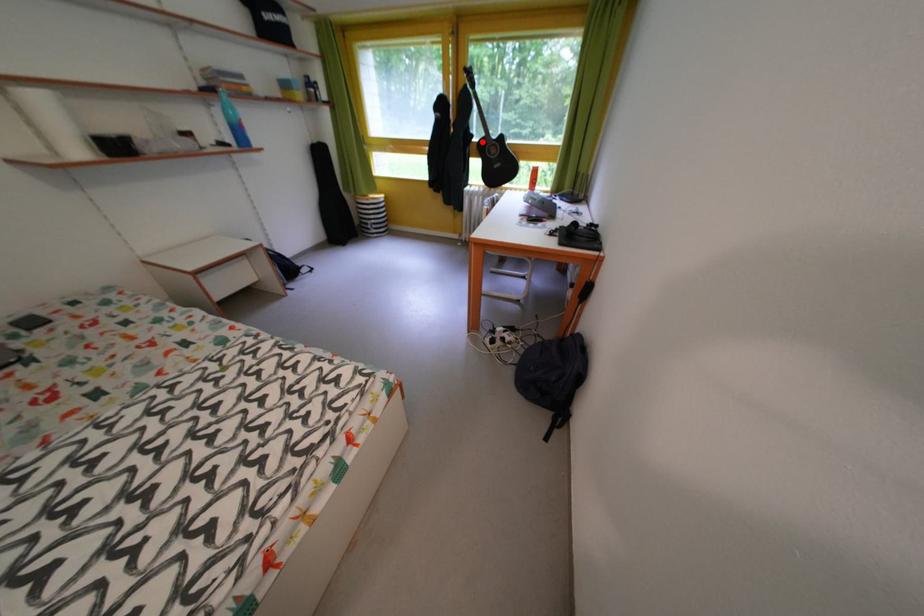
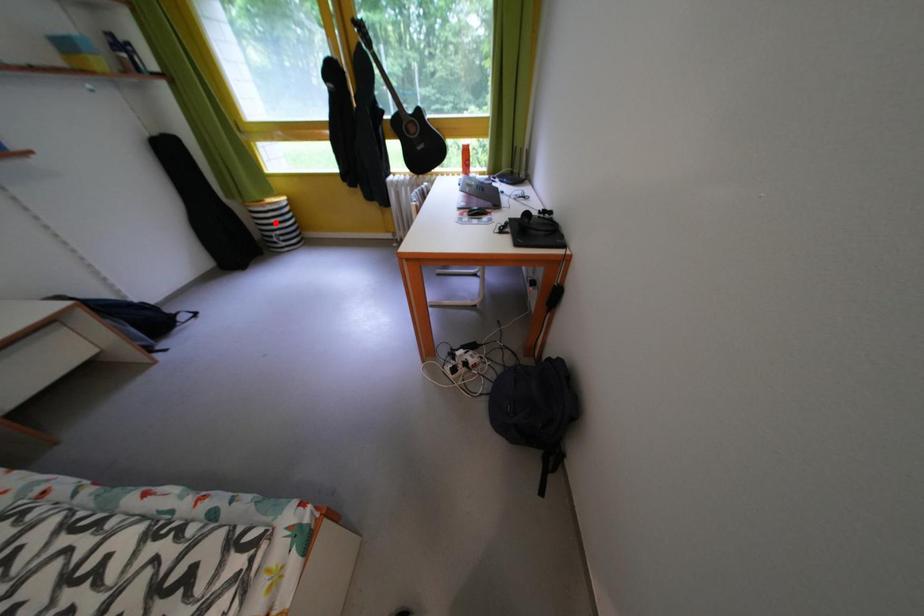
I am providing you with two images of the same scene from different viewpoints. A red point is marked on the first image and another point is marked on the second image. Is the red point in image1 aligned with the point shown in image2?

No